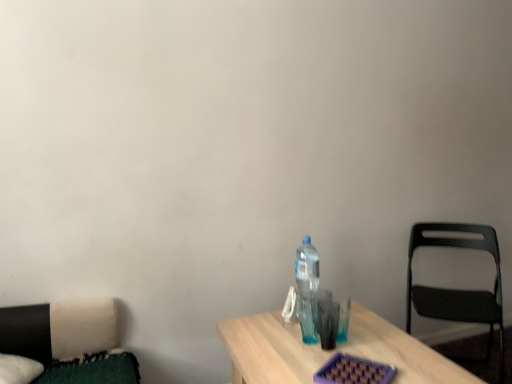
Question: Considering the positions of point (433, 317) and point (305, 306), is point (433, 317) closer or farther from the camera than point (305, 306)?

Choices:
 (A) farther
 (B) closer

Answer: (A)

Question: From the image's perspective, relative to transparent plastic bottle at center-right, is black plastic chair at right above or below?

Choices:
 (A) above
 (B) below

Answer: (B)

Question: Is black plastic chair at right wider or thinner than transparent plastic bottle at center-right?

Choices:
 (A) thin
 (B) wide

Answer: (B)

Question: Does point [x=317, y=261] appear closer or farther from the camera than point [x=436, y=291]?

Choices:
 (A) farther
 (B) closer

Answer: (B)

Question: Considering the positions of transparent plastic bottle at center-right and black plastic chair at right in the image, is transparent plastic bottle at center-right taller or shorter than black plastic chair at right?

Choices:
 (A) tall
 (B) short

Answer: (B)

Question: Considering the positions of transparent plastic bottle at center-right and black plastic chair at right in the image, is transparent plastic bottle at center-right bigger or smaller than black plastic chair at right?

Choices:
 (A) small
 (B) big

Answer: (A)

Question: Is transparent plastic bottle at center-right wider or thinner than black plastic chair at right?

Choices:
 (A) wide
 (B) thin

Answer: (B)